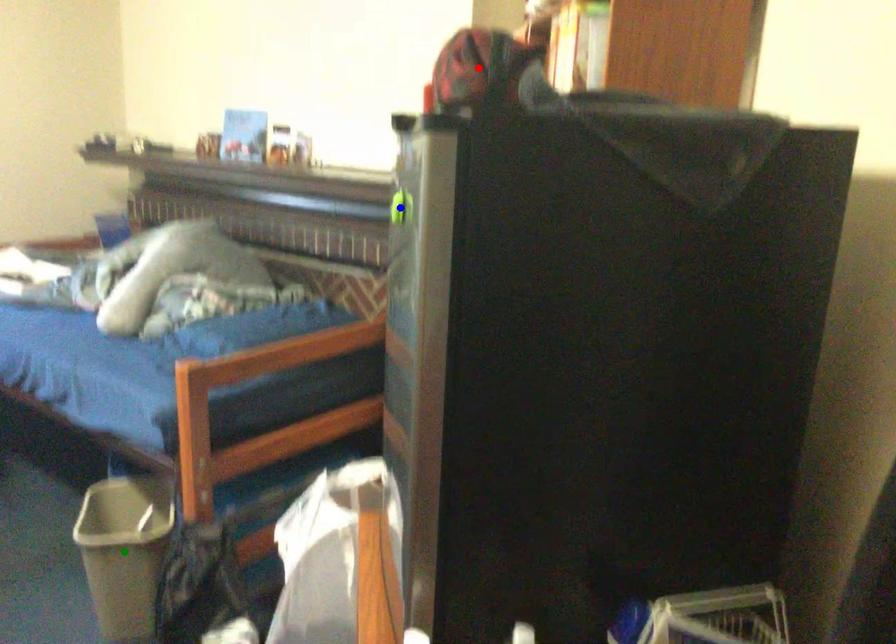
Order these from nearest to farthest:
A) red point
B) green point
C) blue point

1. blue point
2. red point
3. green point